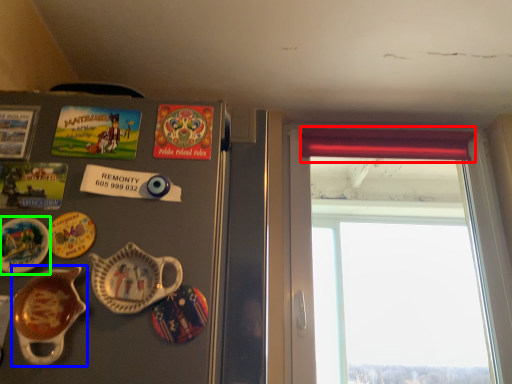
Question: Estimate the real-world distances between objects in this image. Which object is farther from curtain (highlighted by a red box), tableware (highlighted by a blue box) or plate (highlighted by a green box)?

Choices:
 (A) tableware
 (B) plate

Answer: (B)